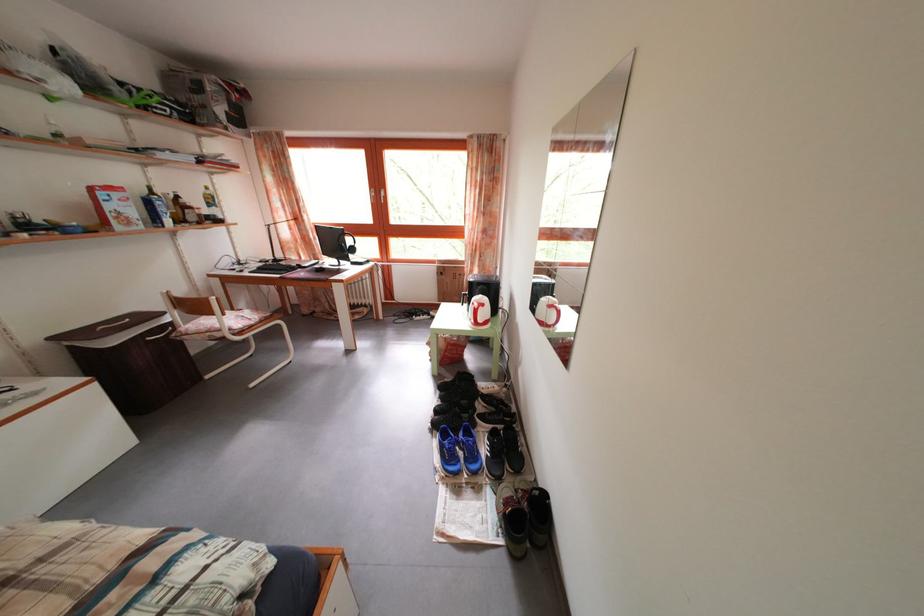
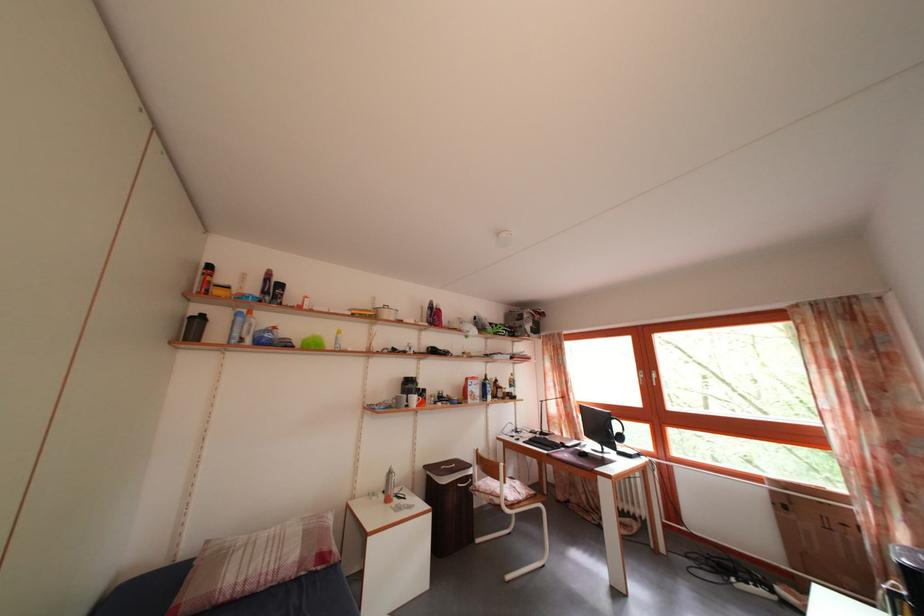
In the second image, find the point that corresponds to the point at 383,200 in the first image.

(652, 382)